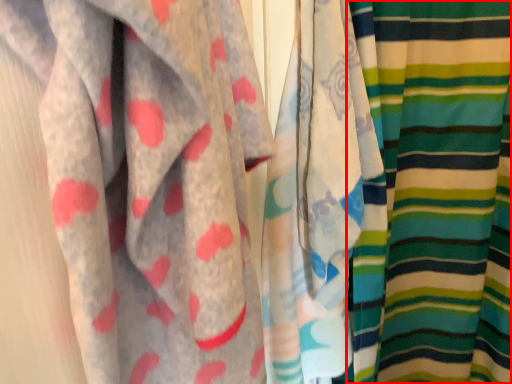
Question: In this image, where is curtain (annotated by the red box) located relative to curtain?

Choices:
 (A) right
 (B) left

Answer: (A)